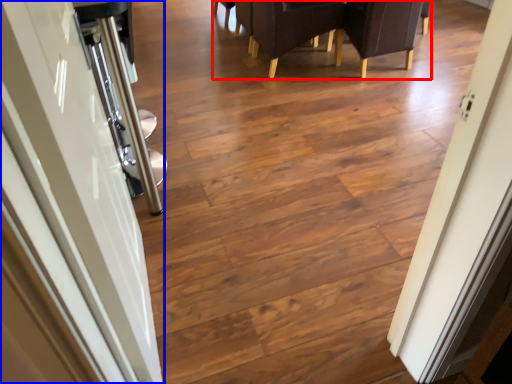
Question: Which object is further to the camera taking this photo, furniture (highlighted by a red box) or door (highlighted by a blue box)?

Choices:
 (A) furniture
 (B) door

Answer: (A)